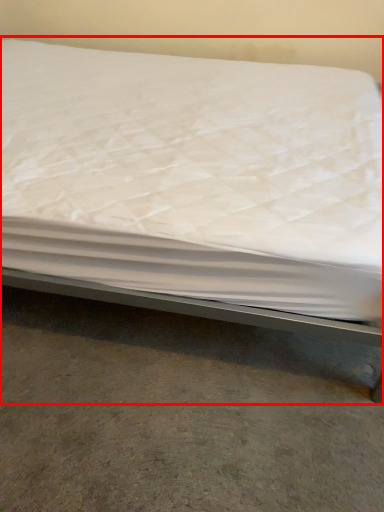
Question: Observing the image, what is the correct spatial positioning of bed (annotated by the red box) in reference to concrete?

Choices:
 (A) right
 (B) left

Answer: (B)